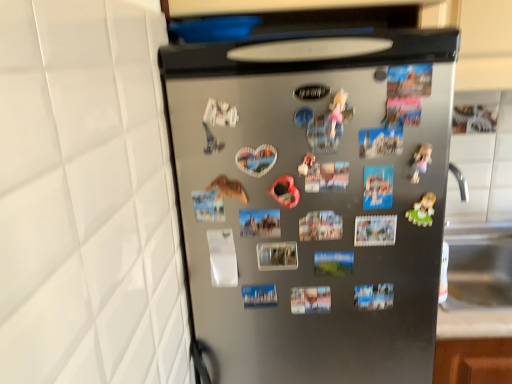
Question: Should I look upward or downward to see plastic green toy at right?

Choices:
 (A) up
 (B) down

Answer: (B)

Question: Considering the relative sizes of satin silver refrigerator at center and plastic green toy at right in the image provided, is satin silver refrigerator at center smaller than plastic green toy at right?

Choices:
 (A) yes
 (B) no

Answer: (B)

Question: Can you confirm if satin silver refrigerator at center is wider than plastic green toy at right?

Choices:
 (A) no
 (B) yes

Answer: (B)

Question: Is satin silver refrigerator at center positioned beyond the bounds of plastic green toy at right?

Choices:
 (A) yes
 (B) no

Answer: (A)

Question: Considering the relative sizes of satin silver refrigerator at center and plastic green toy at right in the image provided, is satin silver refrigerator at center bigger than plastic green toy at right?

Choices:
 (A) no
 (B) yes

Answer: (B)

Question: Is satin silver refrigerator at center with plastic green toy at right?

Choices:
 (A) no
 (B) yes

Answer: (A)

Question: Is satin silver refrigerator at center not close to plastic green toy at right?

Choices:
 (A) yes
 (B) no

Answer: (B)

Question: Is plastic green toy at right further to camera compared to satin silver refrigerator at center?

Choices:
 (A) yes
 (B) no

Answer: (A)

Question: Would you say plastic green toy at right is outside satin silver refrigerator at center?

Choices:
 (A) yes
 (B) no

Answer: (B)

Question: Can you confirm if plastic green toy at right is bigger than satin silver refrigerator at center?

Choices:
 (A) yes
 (B) no

Answer: (B)

Question: Is plastic green toy at right taller than satin silver refrigerator at center?

Choices:
 (A) yes
 (B) no

Answer: (B)

Question: Could you tell me if plastic green toy at right is facing satin silver refrigerator at center?

Choices:
 (A) no
 (B) yes

Answer: (B)

Question: From a real-world perspective, is plastic green toy at right positioned over satin silver refrigerator at center based on gravity?

Choices:
 (A) yes
 (B) no

Answer: (A)

Question: Is satin silver refrigerator at center in front of or behind plastic green toy at right in the image?

Choices:
 (A) behind
 (B) front

Answer: (B)